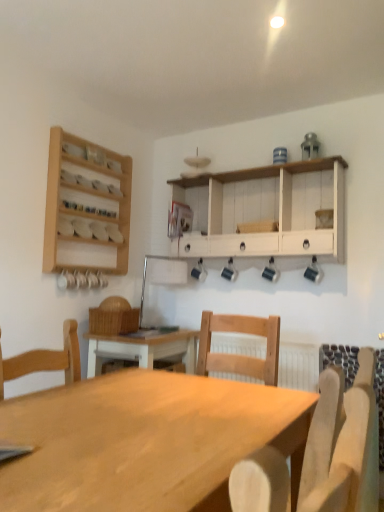
Measure the distance between point (x=85, y=233) and camera.

A distance of 2.69 meters exists between point (x=85, y=233) and camera.

What do you see at coordinates (343, 444) in the screenshot? I see `light wood chair at center` at bounding box center [343, 444].

What do you see at coordinates (265, 210) in the screenshot? I see `white wood cabinet at upper center` at bounding box center [265, 210].

In order to face white wood cabinet at upper center, should I rotate leftwards or rightwards?

Rotate right and turn 7.675 degrees.

Image resolution: width=384 pixels, height=512 pixels. I want to click on wooden spice rack at upper left, so click(x=86, y=206).

Is light wood chair at center looking in the opposite direction of wooden spice rack at upper left?

light wood chair at center is not turned away from wooden spice rack at upper left.

From a real-world perspective, does light wood chair at center sit lower than wooden spice rack at upper left?

Correct, in the physical world, light wood chair at center is lower than wooden spice rack at upper left.

Is light wood chair at center next to wooden spice rack at upper left?

No.

Are white wood cabinet at upper center and light wood table at center far apart?

Yes, white wood cabinet at upper center is far from light wood table at center.

Measure the distance between white wood cabinet at upper center and light wood table at center.

1.45 meters.

Can we say white wood cabinet at upper center lies outside light wood table at center?

That's correct, white wood cabinet at upper center is outside of light wood table at center.

Is white wood cabinet at upper center aimed at light wood table at center?

No, white wood cabinet at upper center is not turned towards light wood table at center.

Considering the sizes of white wood cabinet at upper center and wooden spice rack at upper left in the image, is white wood cabinet at upper center bigger or smaller than wooden spice rack at upper left?

white wood cabinet at upper center is bigger than wooden spice rack at upper left.

Can you see white wood cabinet at upper center touching wooden spice rack at upper left?

No, white wood cabinet at upper center is not in contact with wooden spice rack at upper left.

Is white wood cabinet at upper center shorter than wooden spice rack at upper left?

Indeed, white wood cabinet at upper center has a lesser height compared to wooden spice rack at upper left.

Is white wood cabinet at upper center aimed at wooden spice rack at upper left?

Yes, white wood cabinet at upper center faces towards wooden spice rack at upper left.

Can you confirm if wooden spice rack at upper left is wider than light wood table at center?

No.

From the image's perspective, is wooden spice rack at upper left located above or below light wood table at center?

From the image's perspective, wooden spice rack at upper left appears above light wood table at center.

From the picture: Can you confirm if wooden spice rack at upper left is bigger than light wood table at center?

No.

In the scene shown: Between light wood table at center and wooden spice rack at upper left, which one appears on the left side from the viewer's perspective?

wooden spice rack at upper left.

From a real-world perspective, between light wood table at center and wooden spice rack at upper left, who is vertically lower?

In real-world perspective, light wood table at center is lower.

Which of these two, light wood table at center or wooden spice rack at upper left, is bigger?

Bigger between the two is light wood table at center.

Is light wood table at center located outside wooden spice rack at upper left?

light wood table at center is positioned outside wooden spice rack at upper left.

Considering the positions of objects light wood chair at center and light wood table at center in the image provided, who is more to the right, light wood chair at center or light wood table at center?

light wood chair at center is more to the right.

Consider the image. From the image's perspective, is light wood chair at center on top of light wood table at center?

Correct, light wood chair at center appears higher than light wood table at center in the image.

Is light wood chair at center oriented away from light wood table at center?

No, light wood chair at center is not facing the opposite direction of light wood table at center.

Does light wood chair at center have a larger size compared to light wood table at center?

No, light wood chair at center is not bigger than light wood table at center.

Who is shorter, wooden spice rack at upper left or white wood cabinet at upper center?

white wood cabinet at upper center is shorter.

Is wooden spice rack at upper left not within white wood cabinet at upper center?

That's correct, wooden spice rack at upper left is outside of white wood cabinet at upper center.

From a real-world perspective, is wooden spice rack at upper left physically located above or below white wood cabinet at upper center?

Clearly, from a real-world perspective, wooden spice rack at upper left is above white wood cabinet at upper center.

Can you confirm if wooden spice rack at upper left is positioned to the right of white wood cabinet at upper center?

Incorrect, wooden spice rack at upper left is not on the right side of white wood cabinet at upper center.

Identify the location of shelf that appears on the left of light wood chair at center. Image resolution: width=384 pixels, height=512 pixels. (86, 206).

The height and width of the screenshot is (512, 384). Find the location of `table below the white wood cabinet at upper center (from a real-world perspective)`. table below the white wood cabinet at upper center (from a real-world perspective) is located at coordinates (145, 441).

Based on their spatial positions, is light wood table at center or light wood chair at center closer to wooden spice rack at upper left?

light wood table at center.

From the image, which object appears to be farther from light wood table at center, light wood chair at center or wooden spice rack at upper left?

Among the two, wooden spice rack at upper left is located further to light wood table at center.

Considering their positions, is light wood table at center positioned closer to light wood chair at center than white wood cabinet at upper center?

Among the two, light wood table at center is located nearer to light wood chair at center.

When comparing their distances from wooden spice rack at upper left, does light wood chair at center or light wood table at center seem further?

Among the two, light wood chair at center is located further to wooden spice rack at upper left.

In the scene shown: Estimate the real-world distances between objects in this image. Which object is closer to light wood chair at center, wooden spice rack at upper left or light wood table at center?

Based on the image, light wood table at center appears to be nearer to light wood chair at center.

Based on their spatial positions, is white wood cabinet at upper center or light wood table at center closer to light wood chair at center?

light wood table at center.

Estimate the real-world distances between objects in this image. Which object is closer to light wood chair at center, wooden spice rack at upper left or white wood cabinet at upper center?

white wood cabinet at upper center lies closer to light wood chair at center than the other object.

Based on the photo, based on their spatial positions, is light wood table at center or light wood chair at center closer to white wood cabinet at upper center?

Among the two, light wood table at center is located nearer to white wood cabinet at upper center.

Where is `cabinetry between light wood table at center and wooden spice rack at upper left along the z-axis`? cabinetry between light wood table at center and wooden spice rack at upper left along the z-axis is located at coordinates (265, 210).

Find the location of a particular element. The height and width of the screenshot is (512, 384). chair located between light wood table at center and white wood cabinet at upper center in the depth direction is located at coordinates (343, 444).

The height and width of the screenshot is (512, 384). In order to click on cabinetry positioned between light wood chair at center and wooden spice rack at upper left from near to far in this screenshot , I will do `click(265, 210)`.

At what (x,y) coordinates should I click in order to perform the action: click on chair between light wood table at center and wooden spice rack at upper left in the front-back direction. Please return your answer as a coordinate pair (x, y). Image resolution: width=384 pixels, height=512 pixels. Looking at the image, I should click on (343, 444).